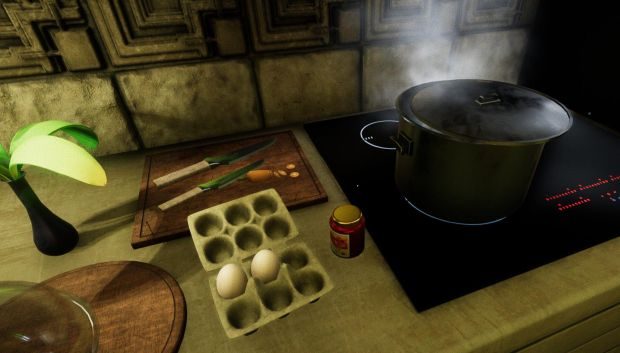
At what (x,y) coordinates should I click in order to perform the action: click on stove top. Please return your answer as a coordinate pair (x, y). Looking at the image, I should click on (485, 259).